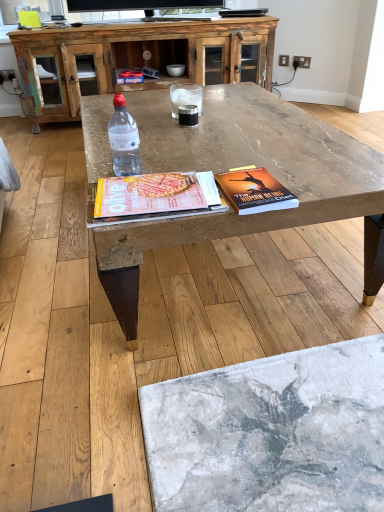
Identify the location of vacant space to the right of transparent plastic bottle at center. (183, 164).